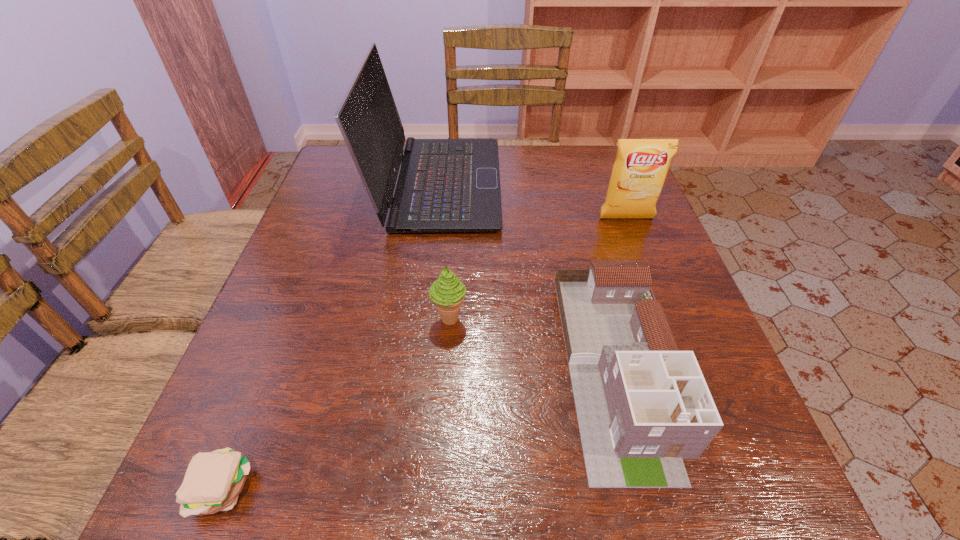
You are a GUI agent. You are given a task and a screenshot of the screen. Output one action in this format:
    pyautogui.click(x=<x>, y=<y>)
    Task: Click on the object at the far edge
    
    Given the screenshot: What is the action you would take?
    pyautogui.click(x=444, y=185)

You are a GUI agent. You are given a task and a screenshot of the screen. Output one action in this format:
    pyautogui.click(x=<x>, y=<y>)
    Task: Click on the dollhouse that is at the near edge
    
    Given the screenshot: What is the action you would take?
    pyautogui.click(x=643, y=406)

Identify the location of patty positioned at the near edge. (213, 481).

Find the location of a particular element. The width and height of the screenshot is (960, 540). laptop computer present at the left edge is located at coordinates (444, 185).

Identify the location of patty that is at the left edge. The image size is (960, 540). (213, 481).

The image size is (960, 540). In order to click on crisp (potato chip) that is at the right edge in this screenshot , I will do `click(641, 166)`.

The width and height of the screenshot is (960, 540). I want to click on dollhouse at the right edge, so click(643, 406).

In order to click on object located at the far left corner in this screenshot , I will do `click(444, 185)`.

This screenshot has height=540, width=960. In order to click on object at the near left corner in this screenshot , I will do `click(213, 481)`.

Find the location of a particular element. This screenshot has height=540, width=960. object that is at the near right corner is located at coordinates (643, 406).